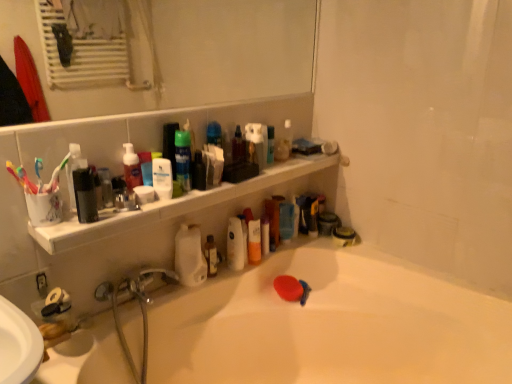
Question: Is the position of matte black soap at lower right, the first toiletry in the back-to-front sequence, less distant than that of white glossy bathtub at lower center?

Choices:
 (A) yes
 (B) no

Answer: (B)

Question: Would you say matte black soap at lower right, the first toiletry in the back-to-front sequence, is outside white glossy bathtub at lower center?

Choices:
 (A) no
 (B) yes

Answer: (A)

Question: Would you consider matte black soap at lower right, the 4th toiletry from the top, to be distant from white glossy bathtub at lower center?

Choices:
 (A) no
 (B) yes

Answer: (A)

Question: Does matte black soap at lower right, positioned as the 4th toiletry in left-to-right order, lie behind white glossy bathtub at lower center?

Choices:
 (A) no
 (B) yes

Answer: (B)

Question: From a real-world perspective, is matte black soap at lower right, positioned as the 4th toiletry in left-to-right order, on white glossy bathtub at lower center?

Choices:
 (A) yes
 (B) no

Answer: (A)

Question: Looking at their shapes, would you say white matte lotion at upper center, the 3th mouthwash from the front, is wider or thinner than clear glass mirror at upper center?

Choices:
 (A) wide
 (B) thin

Answer: (B)

Question: Is white matte lotion at upper center, the 3th mouthwash from the front, in front of or behind clear glass mirror at upper center in the image?

Choices:
 (A) front
 (B) behind

Answer: (B)

Question: From a real-world perspective, is white matte lotion at upper center, which ranks as the third mouthwash in back-to-front order, positioned above or below clear glass mirror at upper center?

Choices:
 (A) above
 (B) below

Answer: (B)

Question: Which is correct: white matte lotion at upper center, marked as the third mouthwash in a right-to-left arrangement, is inside clear glass mirror at upper center, or outside of it?

Choices:
 (A) outside
 (B) inside

Answer: (A)

Question: Is white matte bottle at center wider or thinner than matte black soap at lower right, arranged as the fourth toiletry when viewed from the front?

Choices:
 (A) wide
 (B) thin

Answer: (B)

Question: Based on their positions, is white matte bottle at center located to the left or right of matte black soap at lower right, positioned as the 4th toiletry in left-to-right order?

Choices:
 (A) left
 (B) right

Answer: (A)

Question: Considering the positions of point coord(184,236) and point coord(339,241), is point coord(184,236) closer or farther from the camera than point coord(339,241)?

Choices:
 (A) closer
 (B) farther

Answer: (A)

Question: Looking at the image, does white matte bottle at center seem bigger or smaller compared to matte black soap at lower right, which appears as the 1th toiletry when ordered from the bottom?

Choices:
 (A) small
 (B) big

Answer: (B)

Question: From the image's perspective, is white glossy bathtub at lower center above or below matte black soap at lower right, the 4th toiletry from the top?

Choices:
 (A) below
 (B) above

Answer: (A)

Question: Choose the correct answer: Is white glossy bathtub at lower center inside matte black soap at lower right, which appears as the 1th toiletry when ordered from the bottom, or outside it?

Choices:
 (A) outside
 (B) inside

Answer: (A)